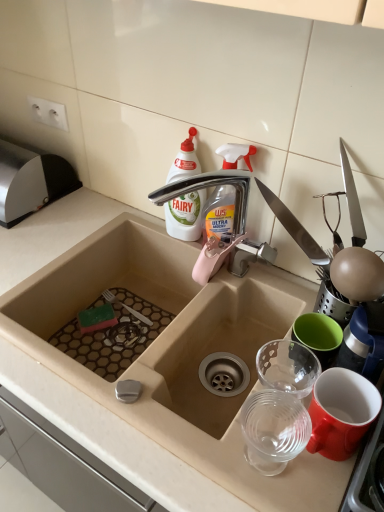
Where is `white plastic bottle at upper center`? white plastic bottle at upper center is located at coordinates (185, 215).

Describe the element at coordinates (161, 332) in the screenshot. The height and width of the screenshot is (512, 384). I see `beige ceramic sink at center` at that location.

Locate an element on the screen. This screenshot has width=384, height=512. transparent plastic spray bottle at upper center is located at coordinates (219, 212).

What is the approximate height of satin silver knife block at upper left?

→ It is 6.18 inches.

In order to face silver metallic tap at upper center, should I rotate leftwards or rightwards?

You should rotate right by 2.970 degrees.

Where is `white plastic bottle at upper center`? white plastic bottle at upper center is located at coordinates (185, 215).

From a real-world perspective, is transparent plastic spray bottle at upper center positioned above or below white plastic bottle at upper center?

From a real-world perspective, transparent plastic spray bottle at upper center is physically above white plastic bottle at upper center.

Which is further, (234,198) or (173,169)?

The point (173,169) is farther.

Is transparent plastic spray bottle at upper center situated inside white plastic bottle at upper center or outside?

transparent plastic spray bottle at upper center cannot be found inside white plastic bottle at upper center.

From the image's perspective, between white plastic bottle at upper center and silver metallic tap at upper center, which one is located above?

white plastic bottle at upper center is shown above in the image.

Is white plastic bottle at upper center outside of silver metallic tap at upper center?

Yes.

Is white plastic bottle at upper center wider or thinner than silver metallic tap at upper center?

white plastic bottle at upper center is thinner than silver metallic tap at upper center.

From a real-world perspective, does white plastic bottle at upper center stand above silver metallic tap at upper center?

Indeed, from a real-world perspective, white plastic bottle at upper center stands above silver metallic tap at upper center.

From a real-world perspective, is silver metallic tap at upper center under beige ceramic sink at center?

No, from a real-world perspective, silver metallic tap at upper center is not beneath beige ceramic sink at center.

Consider the image. Is silver metallic tap at upper center spatially inside beige ceramic sink at center, or outside of it?

silver metallic tap at upper center cannot be found inside beige ceramic sink at center.

You are a GUI agent. You are given a task and a screenshot of the screen. Output one action in this format:
    pyautogui.click(x=<x>, y=<y>)
    Task: Click on the sink that appears below the silver metallic tap at upper center (from a real-world perspective)
    This screenshot has height=512, width=384.
    Given the screenshot: What is the action you would take?
    pyautogui.click(x=161, y=332)

Looking at this image, considering the relative sizes of silver metallic tap at upper center and beige ceramic sink at center in the image provided, is silver metallic tap at upper center shorter than beige ceramic sink at center?

Indeed, silver metallic tap at upper center has a lesser height compared to beige ceramic sink at center.

Based on the photo, in terms of width, does beige ceramic sink at center look wider or thinner when compared to transparent plastic spray bottle at upper center?

In the image, beige ceramic sink at center appears to be wider than transparent plastic spray bottle at upper center.

Based on the photo, do you think beige ceramic sink at center is within transparent plastic spray bottle at upper center, or outside of it?

The correct answer is: outside.

Identify the location of sink lying in front of the transparent plastic spray bottle at upper center. (161, 332).

How many degrees apart are the facing directions of beige ceramic sink at center and transparent plastic spray bottle at upper center?

26.5 degrees.

Who is smaller, transparent plastic spray bottle at upper center or transparent plastic cups at right?

With smaller size is transparent plastic cups at right.

The height and width of the screenshot is (512, 384). I want to click on cleaning product that appears above the transparent plastic cups at right (from a real-world perspective), so click(219, 212).

Does point (224, 198) lie in front of point (285, 457)?

No, it is not.

Is transparent plastic spray bottle at upper center oriented away from transparent plastic cups at right?

No, transparent plastic spray bottle at upper center is not facing away from transparent plastic cups at right.

Who is shorter, white plastic bottle at upper center or transparent plastic cups at right?

transparent plastic cups at right is shorter.

Considering the relative positions of white plastic bottle at upper center and transparent plastic cups at right in the image provided, is white plastic bottle at upper center in front of transparent plastic cups at right?

No, white plastic bottle at upper center is behind transparent plastic cups at right.

This screenshot has height=512, width=384. I want to click on bottle lying behind the transparent plastic cups at right, so click(185, 215).

Between point (175, 204) and point (273, 426), which one is positioned behind?

Positioned behind is point (175, 204).

Which object is further away from the camera, transparent plastic cups at right or satin silver knife block at upper left?

satin silver knife block at upper left.

Does point (301, 439) lie in front of point (6, 181)?

Yes, it is in front of point (6, 181).

Looking at this image, would you say transparent plastic cups at right is inside or outside satin silver knife block at upper left?

transparent plastic cups at right exists outside the volume of satin silver knife block at upper left.

From the image's perspective, would you say transparent plastic cups at right is shown under satin silver knife block at upper left?

Correct, transparent plastic cups at right appears lower than satin silver knife block at upper left in the image.

The width and height of the screenshot is (384, 512). I want to click on cleaning product located above the white plastic bottle at upper center (from a real-world perspective), so click(x=219, y=212).

Where is `bottle lying above the silver metallic tap at upper center (from the image's perspective)`? This screenshot has height=512, width=384. bottle lying above the silver metallic tap at upper center (from the image's perspective) is located at coordinates (185, 215).

Which object lies further to the anchor point transparent plastic cups at right, white plastic bottle at upper center or silver metallic tap at upper center?

Based on the image, white plastic bottle at upper center appears to be further to transparent plastic cups at right.

Looking at this image, considering their positions, is transparent plastic cups at right positioned closer to transparent plastic spray bottle at upper center than white plastic bottle at upper center?

Based on the image, white plastic bottle at upper center appears to be nearer to transparent plastic spray bottle at upper center.

From the image, which object appears to be nearer to satin silver knife block at upper left, transparent plastic cups at right or transparent plastic spray bottle at upper center?

The object closer to satin silver knife block at upper left is transparent plastic spray bottle at upper center.

Looking at the image, which one is located closer to white plastic bottle at upper center, satin silver knife block at upper left or silver metallic tap at upper center?

silver metallic tap at upper center is positioned closer to the anchor white plastic bottle at upper center.

Considering their positions, is beige ceramic sink at center positioned closer to transparent plastic cups at right than silver metallic tap at upper center?

The object closer to transparent plastic cups at right is beige ceramic sink at center.

When comparing their distances from beige ceramic sink at center, does transparent plastic spray bottle at upper center or transparent plastic cups at right seem further?

transparent plastic cups at right lies further to beige ceramic sink at center than the other object.

Which object lies further to the anchor point transparent plastic spray bottle at upper center, white plastic bottle at upper center or silver metallic tap at upper center?

The object further to transparent plastic spray bottle at upper center is white plastic bottle at upper center.

Which object lies nearer to the anchor point transparent plastic cups at right, beige ceramic sink at center or transparent plastic spray bottle at upper center?

Based on the image, beige ceramic sink at center appears to be nearer to transparent plastic cups at right.

This screenshot has width=384, height=512. I want to click on tap between transparent plastic spray bottle at upper center and beige ceramic sink at center in the up-down direction, so click(x=216, y=187).

Find the location of a particular element. The image size is (384, 512). bottle between satin silver knife block at upper left and beige ceramic sink at center vertically is located at coordinates (185, 215).

Locate an element on the screen. The height and width of the screenshot is (512, 384). cleaning product between silver metallic tap at upper center and white plastic bottle at upper center along the z-axis is located at coordinates (219, 212).

Where is `sink situated between satin silver knife block at upper left and transparent plastic cups at right from left to right`? The image size is (384, 512). sink situated between satin silver knife block at upper left and transparent plastic cups at right from left to right is located at coordinates (161, 332).